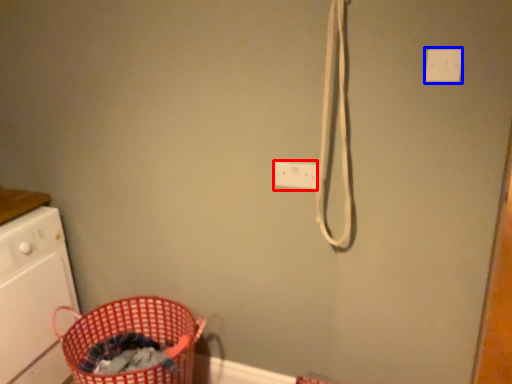
Question: Among these objects, which one is farthest to the camera, electric outlet (highlighted by a red box) or light switch (highlighted by a blue box)?

Choices:
 (A) electric outlet
 (B) light switch

Answer: (A)